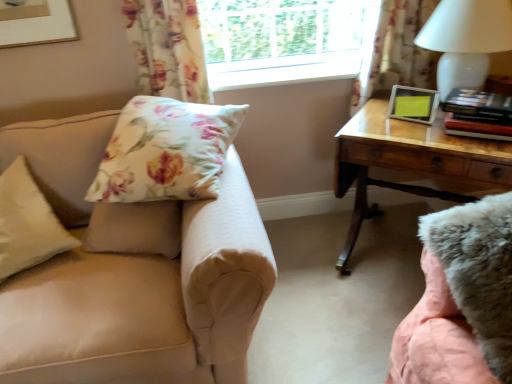
Find the location of `free region under floral fabric curtain at upper right, which ranks as the 1th curtain in right-to-left order (from a real-world perspective)`. free region under floral fabric curtain at upper right, which ranks as the 1th curtain in right-to-left order (from a real-world perspective) is located at coordinates (389, 209).